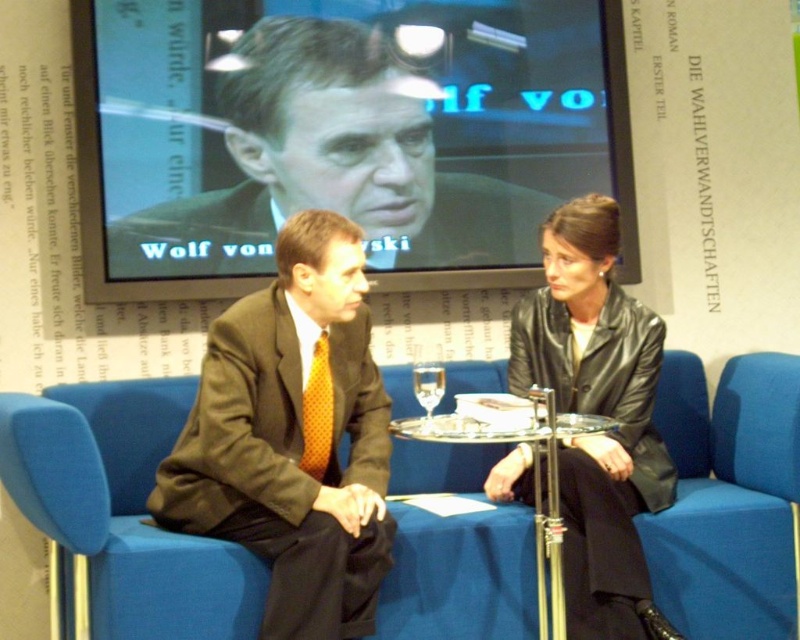
You are a photographer who needs to adjust the lighting to ensure the black leather jacket at center is properly illuminated. Based on its position, where should you place the light source relative to the jacket?

The black leather jacket at center is located at point (598, 413). To properly illuminate it, the light source should be positioned in front of the jacket to ensure even lighting and reduce shadows.

You are a virtual assistant trying to guide a user to sit in the blue fabric chair at center. Based on the scene description, where exactly should the user move to locate the chair?

The blue fabric chair at center is located at point coordinates of 0.797 on the x axis and 0.155 on the y axis. The user should move towards those coordinates to locate the chair.